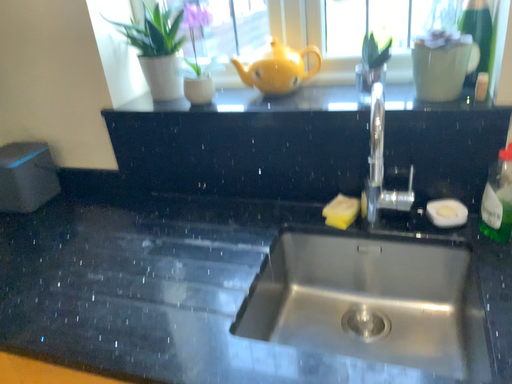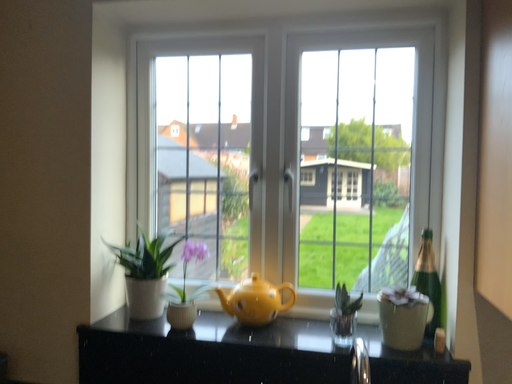
Question: Which way did the camera rotate in the video?

Choices:
 (A) rotated right
 (B) rotated left

Answer: (A)